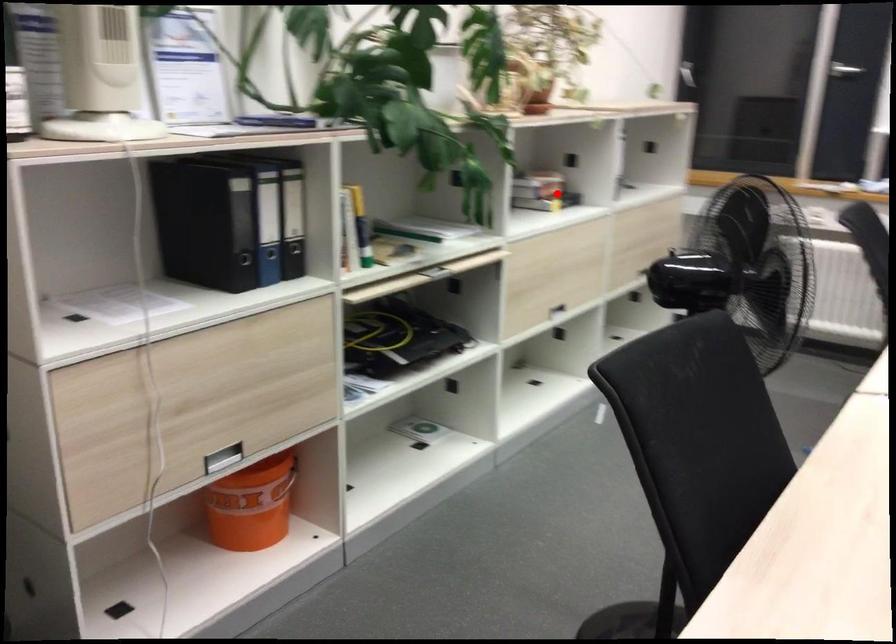
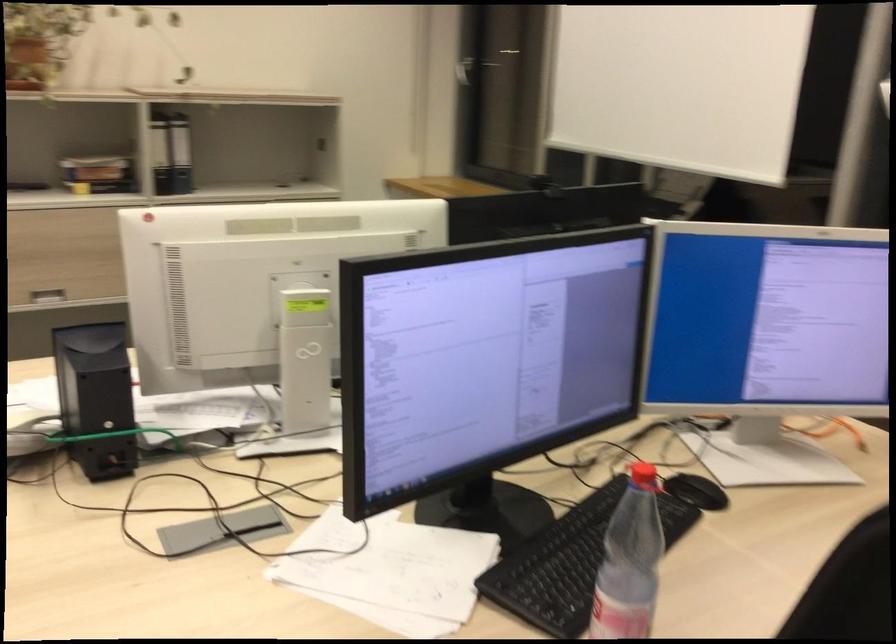
Question: I am providing you with two images of the same scene from different viewpoints. A red point is marked on the first image. Is the red point's position out of view in image 2?

Choices:
 (A) Yes
 (B) No

Answer: (B)